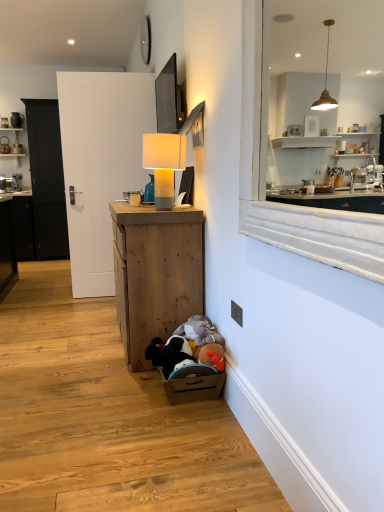
The image size is (384, 512). Identify the location of vacant location below matte gray table lamp at center (from a real-world perspective). (159, 208).